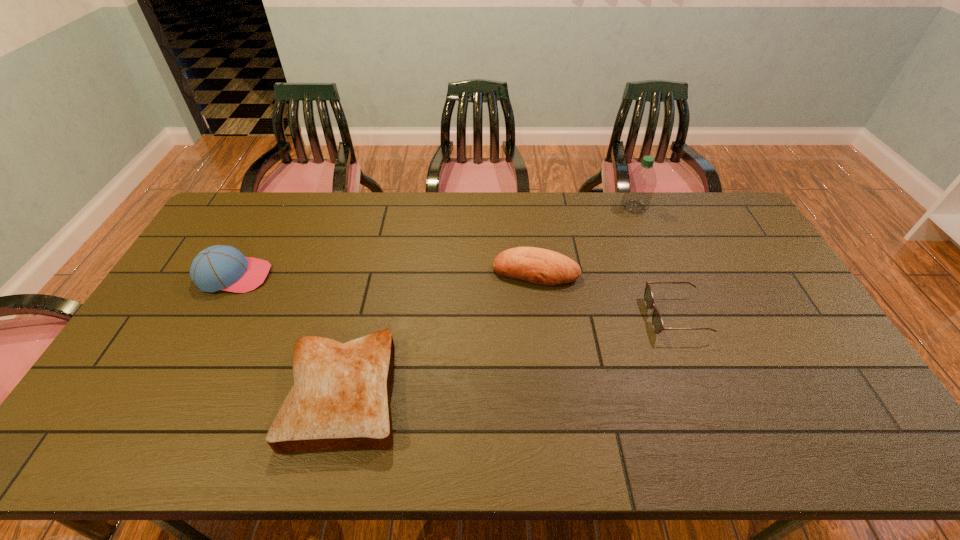
Locate an element on the screen. The height and width of the screenshot is (540, 960). the farthest object is located at coordinates tap(641, 183).

You are a GUI agent. You are given a task and a screenshot of the screen. Output one action in this format:
    pyautogui.click(x=<x>, y=<y>)
    Task: Click on the tallest object
    
    Given the screenshot: What is the action you would take?
    pyautogui.click(x=641, y=183)

Locate an element on the screen. baseball cap is located at coordinates (221, 267).

Locate an element on the screen. The height and width of the screenshot is (540, 960). the fourth shortest object is located at coordinates (221, 267).

The width and height of the screenshot is (960, 540). In order to click on the third tallest object in this screenshot , I will do `click(539, 266)`.

At what (x,y) coordinates should I click in order to perform the action: click on the taller bread. Please return your answer as a coordinate pair (x, y). This screenshot has height=540, width=960. Looking at the image, I should click on (539, 266).

This screenshot has width=960, height=540. I want to click on spectacles, so click(x=657, y=322).

The height and width of the screenshot is (540, 960). I want to click on the left bread, so click(340, 400).

Where is `the fourth object from right to left`? Image resolution: width=960 pixels, height=540 pixels. the fourth object from right to left is located at coordinates (340, 400).

Where is `vacant space situated on the front of the farthest object`? vacant space situated on the front of the farthest object is located at coordinates (665, 285).